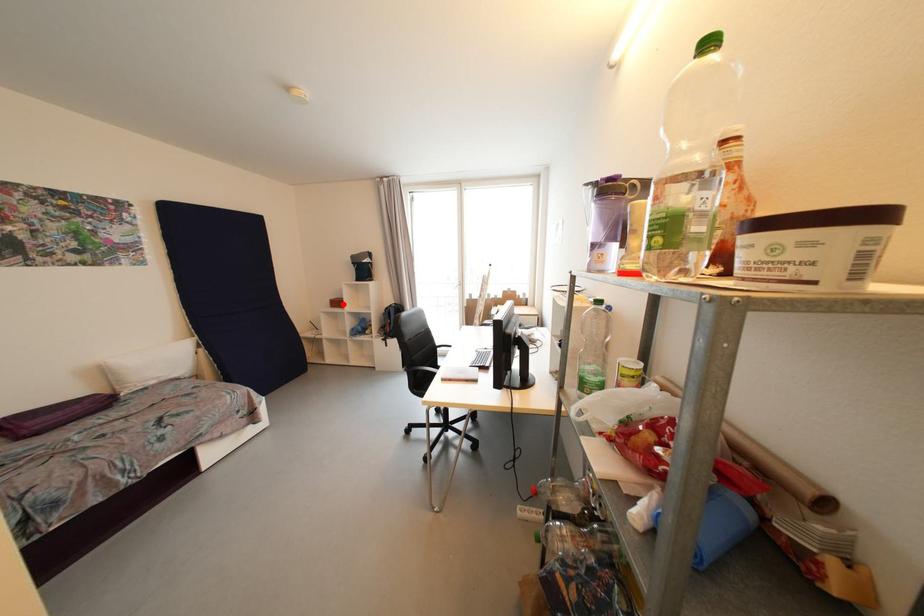
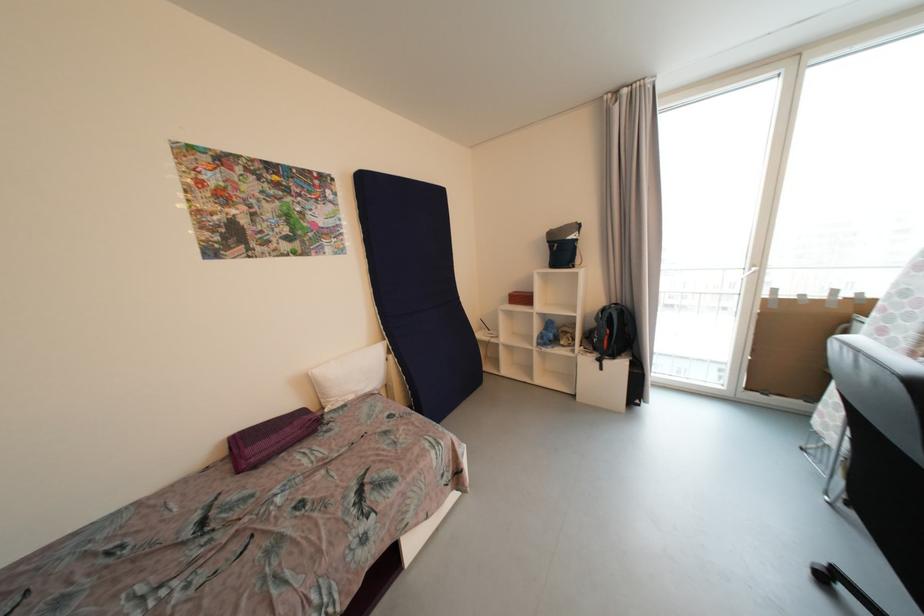
Question: I am providing you with two images of the same scene from different viewpoints. A red point is marked on the first image. At the location where the point appears in image 1, is it still visible in image 2?

Choices:
 (A) Yes
 (B) No

Answer: (A)